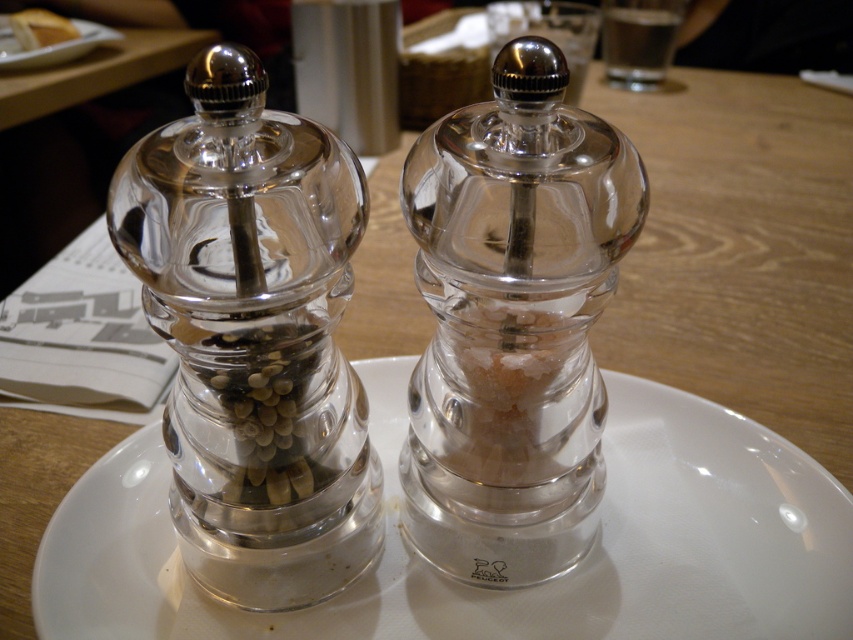
Can you confirm if transparent glass salt shaker at center is wider than white glossy plate at upper left?

A: Yes, transparent glass salt shaker at center is wider than white glossy plate at upper left.

Does transparent glass salt shaker at center have a smaller size compared to white glossy plate at upper left?

No.

Which is behind, point (503, 112) or point (57, 44)?

The point (57, 44) is behind.

What are the coordinates of `transparent glass salt shaker at center` in the screenshot? It's located at (512, 323).

Who is taller, transparent glass plate at center or transparent glass salt shaker at center?

transparent glass salt shaker at center is taller.

Does point (511, 598) lie in front of point (634, 237)?

No, (511, 598) is further to viewer.

Is point (759, 452) positioned after point (451, 448)?

Yes.

Where is `transparent glass plate at center`? The width and height of the screenshot is (853, 640). transparent glass plate at center is located at coordinates (498, 589).

How far apart are transparent glass salt shaker at center and matte white bread at upper left?

3.60 feet

Where is `transparent glass salt shaker at center`? The image size is (853, 640). transparent glass salt shaker at center is located at coordinates (512, 323).

You are a GUI agent. You are given a task and a screenshot of the screen. Output one action in this format:
    pyautogui.click(x=<x>, y=<y>)
    Task: Click on the transparent glass salt shaker at center
    The width and height of the screenshot is (853, 640).
    Given the screenshot: What is the action you would take?
    pyautogui.click(x=512, y=323)